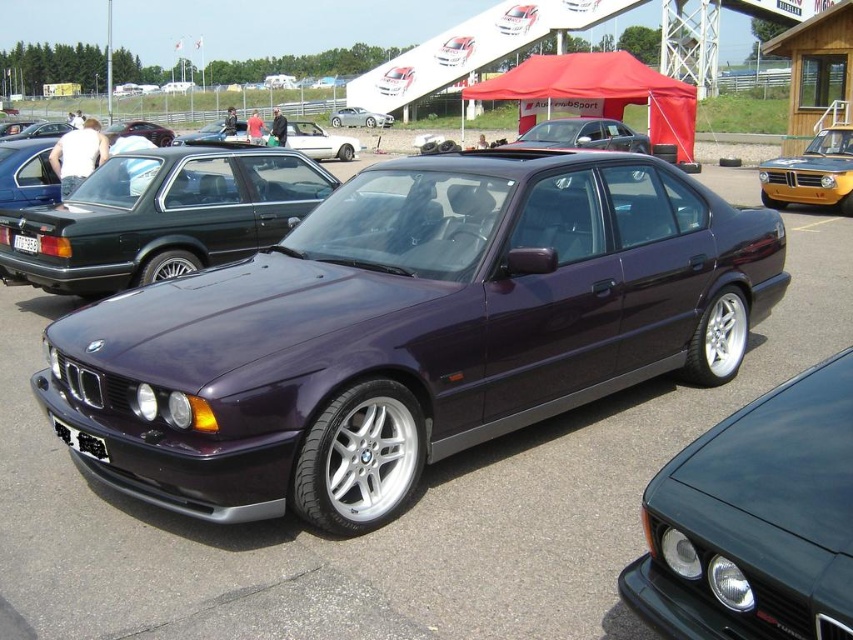
Question: Which object appears closest to the camera in this image?

Choices:
 (A) purple metallic sedan at center
 (B) black plastic license plate at center
 (C) satin silver sedan at center
 (D) metallic yellow car at right

Answer: (A)

Question: Can you confirm if black plastic license plate at front is positioned to the left of black plastic license plate at center?

Choices:
 (A) yes
 (B) no

Answer: (B)

Question: Can you confirm if purple metallic car at center is positioned to the left of black plastic license plate at front?

Choices:
 (A) yes
 (B) no

Answer: (B)

Question: Which point is farther to the camera?

Choices:
 (A) black plastic license plate at front
 (B) purple metallic car at center
 (C) metallic yellow car at right
 (D) satin silver sedan at center

Answer: (D)

Question: Which is farther from the black plastic license plate at center?

Choices:
 (A) purple metallic sedan at center
 (B) white glossy sedan at center
 (C) glossy black car at lower right

Answer: (B)

Question: Is satin silver sedan at center below black plastic license plate at center?

Choices:
 (A) no
 (B) yes

Answer: (A)